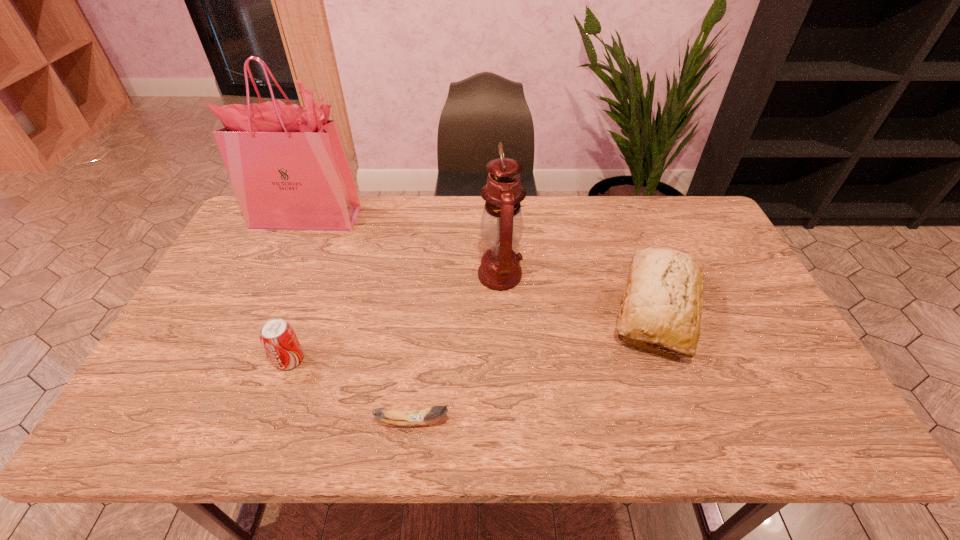
The height and width of the screenshot is (540, 960). I want to click on blank space located 0.130m on the right of the bread, so click(757, 309).

What are the coordinates of `vacant space located 0.140m on the left of the soda` in the screenshot? It's located at (219, 360).

In order to click on free location located at the stem of the banana in this screenshot , I will do `click(554, 422)`.

I want to click on object located in the far edge section of the desktop, so click(x=287, y=164).

Identify the location of object that is at the near edge. (418, 417).

Where is `object at the left edge`? The height and width of the screenshot is (540, 960). object at the left edge is located at coordinates (287, 164).

Locate an element on the screen. Image resolution: width=960 pixels, height=540 pixels. object that is at the right edge is located at coordinates pyautogui.click(x=663, y=297).

Image resolution: width=960 pixels, height=540 pixels. I want to click on object present at the far left corner, so tap(287, 164).

You are a GUI agent. You are given a task and a screenshot of the screen. Output one action in this format:
    pyautogui.click(x=<x>, y=<y>)
    Task: Click on the vacant position at the far edge of the desktop
    The image size is (960, 540).
    Given the screenshot: What is the action you would take?
    pyautogui.click(x=593, y=225)

I want to click on vacant space at the near edge, so click(x=602, y=427).